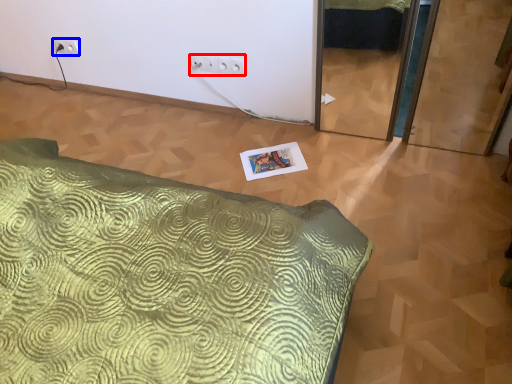
Question: Which of the following is the closest to the observer, electric outlet (highlighted by a red box) or electric outlet (highlighted by a blue box)?

Choices:
 (A) electric outlet
 (B) electric outlet

Answer: (A)